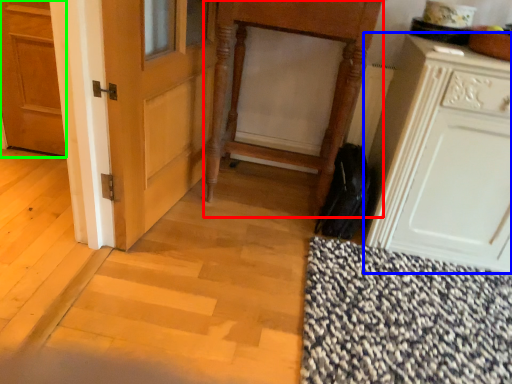
Question: Estimate the real-world distances between objects in this image. Which object is closer to vanity (highlighted by a red box), cabinetry (highlighted by a blue box) or door (highlighted by a green box)?

Choices:
 (A) cabinetry
 (B) door

Answer: (A)